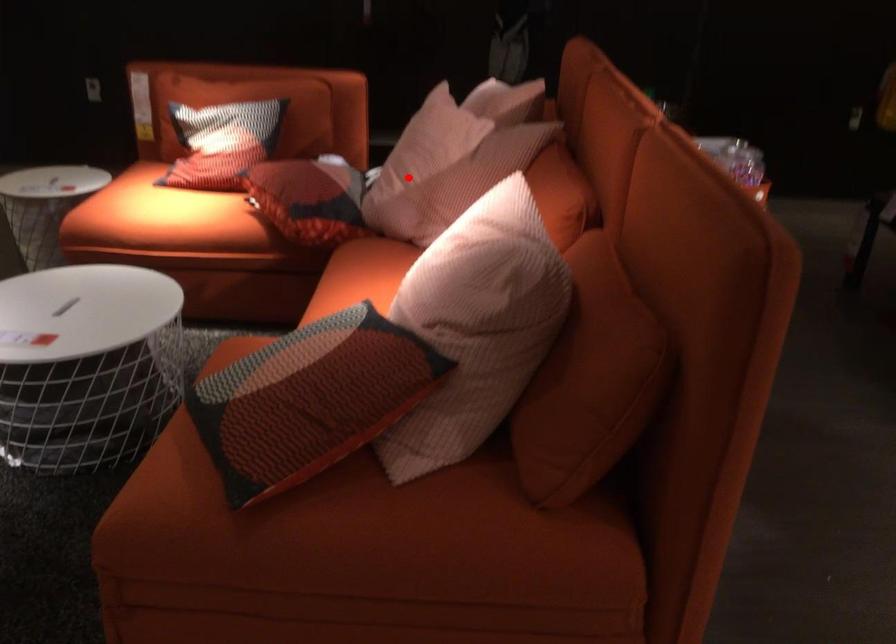
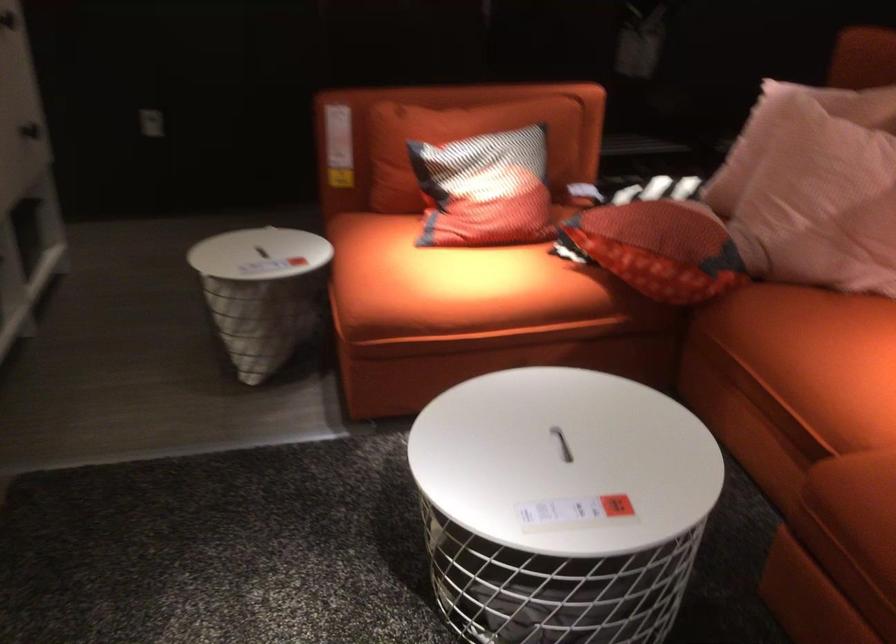
Find the pixel in the second image that matches the highlighted location in the first image.

(823, 198)